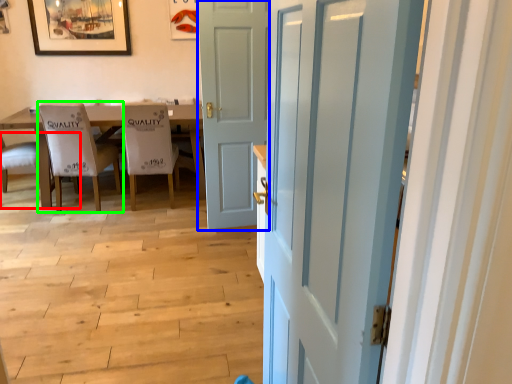
Question: Which object is the farthest from chair (highlighted by a red box)? Choose among these: door (highlighted by a blue box) or chair (highlighted by a green box).

Choices:
 (A) door
 (B) chair

Answer: (A)